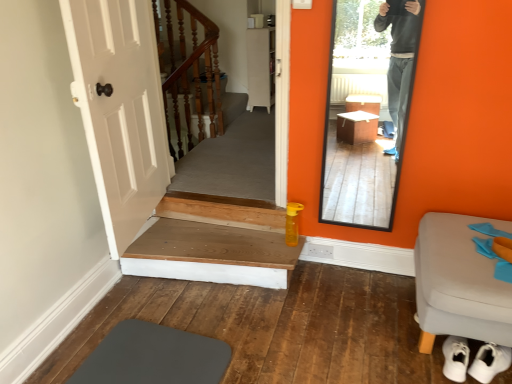
I want to click on free spot to the right of wooden at bottom, which is the 2th stairs from back to front, so click(346, 307).